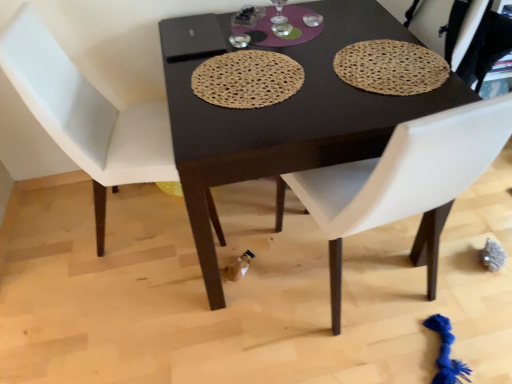
This screenshot has height=384, width=512. Find the location of `spots to the right of natural fiber placemat at center, the 1th mat when ordered from left to right`. spots to the right of natural fiber placemat at center, the 1th mat when ordered from left to right is located at coordinates (352, 82).